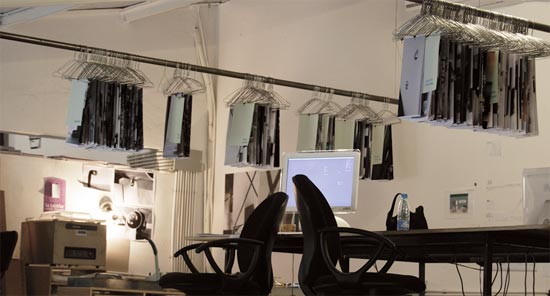
Locate an element on the screen. ceiling is located at coordinates (96, 4).